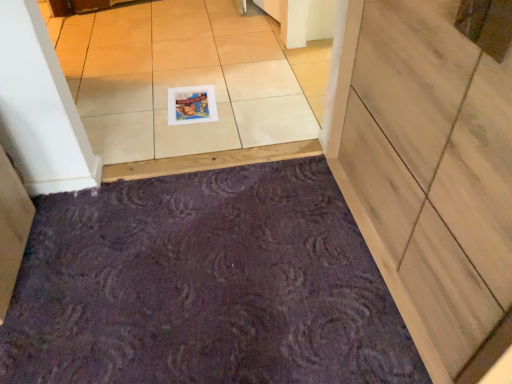
The image size is (512, 384). I want to click on free space in front of matte plastic postcard at center, so click(x=184, y=138).